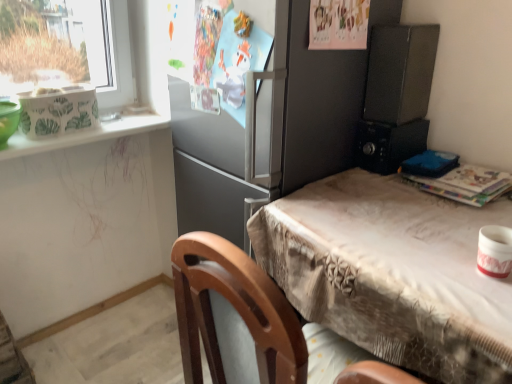
You are a GUI agent. You are given a task and a screenshot of the screen. Output one action in this format:
    pyautogui.click(x=<x>, y=<y>)
    Task: Click on the free point in front of black plastic microwave at right, which is the second appliance in bottom-to-top order
    Image resolution: width=512 pixels, height=384 pixels.
    Given the screenshot: What is the action you would take?
    pyautogui.click(x=385, y=189)